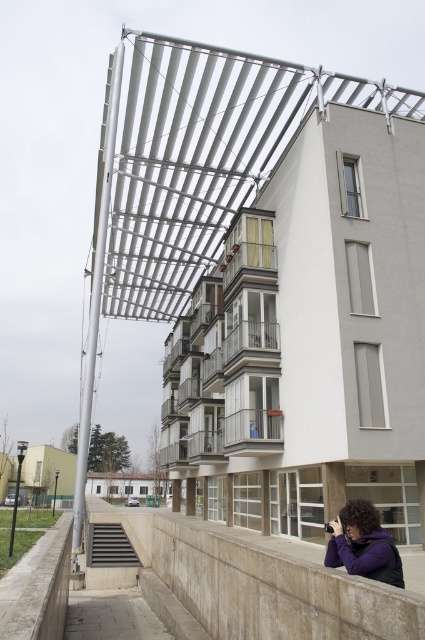
Question: Is concrete ledge at lower center wider than purple fleece jacket at lower center?

Choices:
 (A) yes
 (B) no

Answer: (A)

Question: Is concrete ledge at lower center to the right of purple fleece jacket at lower center from the viewer's perspective?

Choices:
 (A) no
 (B) yes

Answer: (A)

Question: Can you confirm if concrete ledge at lower center is smaller than purple fleece jacket at lower center?

Choices:
 (A) yes
 (B) no

Answer: (B)

Question: Which of the following is the farthest from the observer?

Choices:
 (A) (396, 620)
 (B) (362, 509)

Answer: (B)